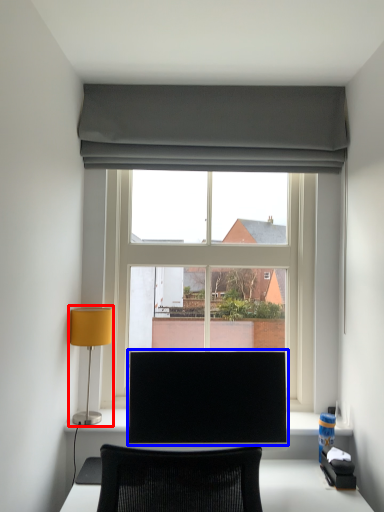
Question: Which point is closer to the camera, table lamp (highlighted by a red box) or computer monitor (highlighted by a blue box)?

Choices:
 (A) table lamp
 (B) computer monitor

Answer: (B)